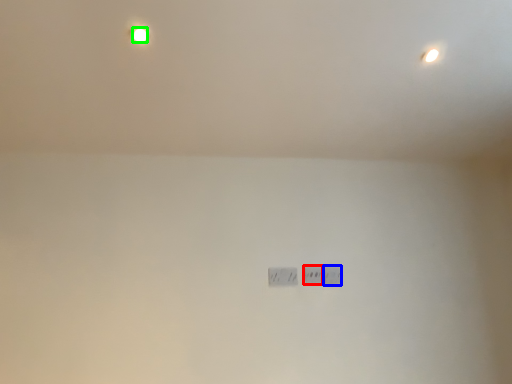
Question: Estimate the real-world distances between objects in this image. Which object is closer to power plugs and sockets (highlighted by a red box), power plugs and sockets (highlighted by a blue box) or light bulb (highlighted by a green box)?

Choices:
 (A) power plugs and sockets
 (B) light bulb

Answer: (A)